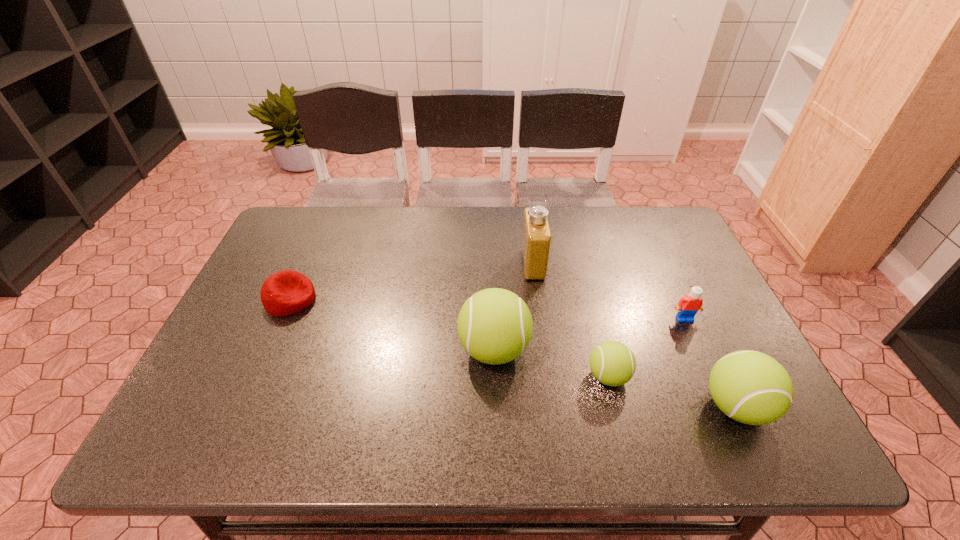
All tennis balls are currently evenly spaced. To continue this pattern, where would you add another tennis ball on the left? Please point out a vacant spot. Please provide its 2D coordinates. Your answer should be formatted as a tuple, i.e. [(x, y)], where the tuple contains the x and y coordinates of a point satisfying the conditions above.

[(392, 325)]